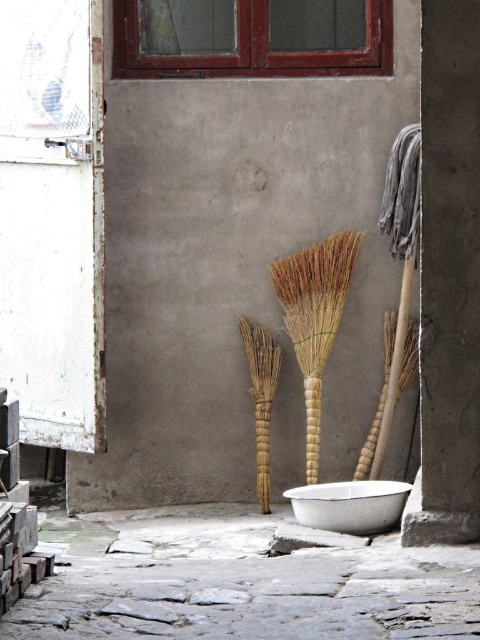
Question: Which of the following is the farthest from the observer?

Choices:
 (A) (300, 288)
 (B) (379, 531)

Answer: (A)

Question: Can you confirm if natural straw broom at center is wider than brown straw broom at center?

Choices:
 (A) yes
 (B) no

Answer: (A)

Question: Which point appears farthest from the camera in this image?

Choices:
 (A) (324, 500)
 (B) (272, 369)
 (C) (336, 278)

Answer: (B)

Question: Is natural straw broom at center above white enamel bowl at lower center?

Choices:
 (A) yes
 (B) no

Answer: (A)

Question: Which point is closer to the camera taking this photo?

Choices:
 (A) (310, 326)
 (B) (261, 417)
 (C) (388, 499)

Answer: (C)

Question: Can you confirm if natural straw broom at center is wider than white enamel bowl at lower center?

Choices:
 (A) yes
 (B) no

Answer: (B)